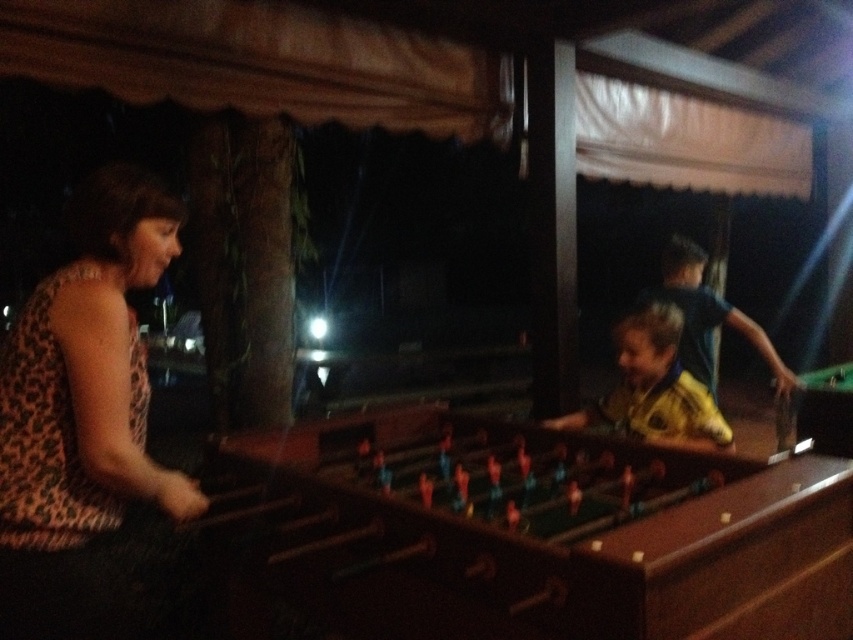
Question: Among these points, which one is farthest from the camera?

Choices:
 (A) (573, 445)
 (B) (79, 573)
 (C) (660, 321)

Answer: (C)

Question: Can you confirm if leopard print fabric at left is positioned above yellow jersey at center?

Choices:
 (A) yes
 (B) no

Answer: (A)

Question: Which point is closer to the camera taking this photo?

Choices:
 (A) (526, 611)
 (B) (654, 376)
 (C) (71, 346)

Answer: (A)

Question: Is leopard print fabric at left thinner than yellow jersey at center?

Choices:
 (A) yes
 (B) no

Answer: (A)

Question: Which object is positioned closest to the leopard print fabric at left?

Choices:
 (A) yellow jersey at center
 (B) brown wooden foosball table at center

Answer: (B)

Question: Can you confirm if brown wooden foosball table at center is wider than yellow jersey at center?

Choices:
 (A) yes
 (B) no

Answer: (A)